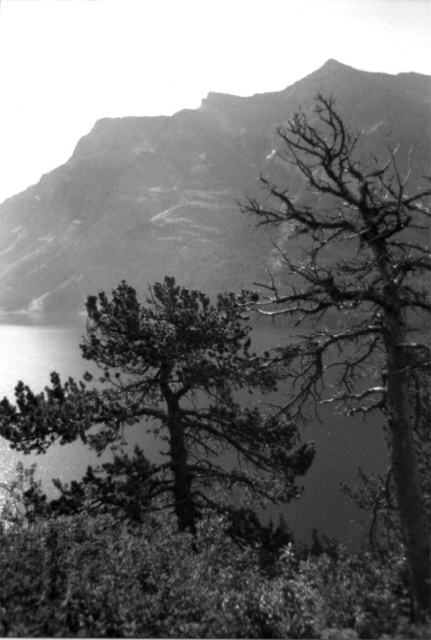
You are a photographer positioned at the origin point of the image. You want to capture the dark green textured tree at center in your shot. Based on its coordinates, is it located closer to the top or bottom of the image?

The dark green textured tree at center is located at coordinates point (x=165, y=404). Since the y coordinate is 0.383, which is less than 0.5, it is closer to the bottom of the image.

You are a hiker planning to take a photo of the rugged stone mountain at upper center from the point marked at coordinates point (181, 188). Is this point a suitable location to capture the mountain in the background?

Yes, the point (181, 188) corresponds to the rugged stone mountain at upper center, so this location is ideal for capturing the mountain in the background.

In the black and white photo, you see a dark green textured tree at center and a dead wood tree at upper right. Which tree is positioned to the left of the other?

The dark green textured tree at center is to the left of the dead wood tree at upper right.